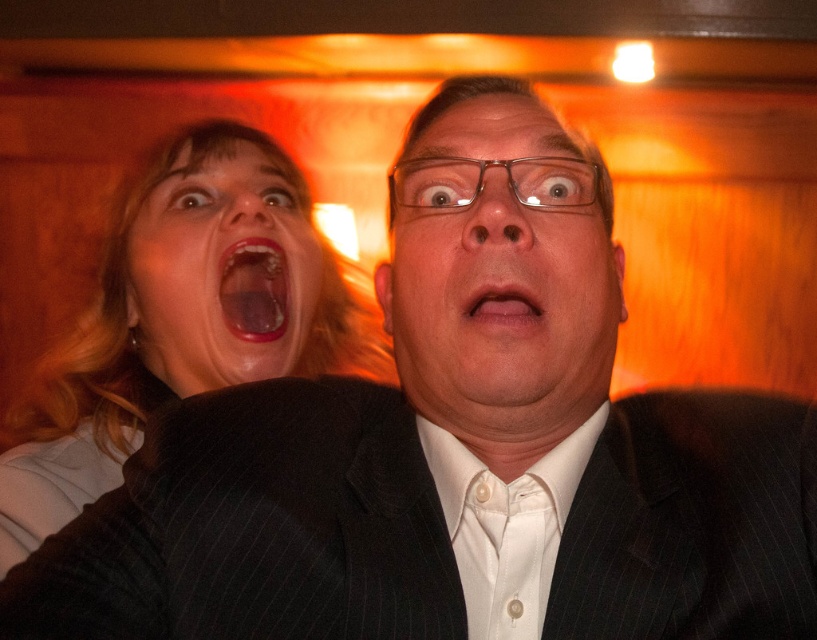
Question: Which point appears closest to the camera in this image?

Choices:
 (A) (528, 308)
 (B) (516, 609)

Answer: (A)

Question: Is matte black jacket at left wider than matte skin face at upper left?

Choices:
 (A) yes
 (B) no

Answer: (A)

Question: Is matte black jacket at left bigger than matte black suit at center?

Choices:
 (A) no
 (B) yes

Answer: (B)

Question: Is matte black jacket at left smaller than white satin tie at center?

Choices:
 (A) yes
 (B) no

Answer: (B)

Question: Among these points, which one is farthest from the camera?

Choices:
 (A) (246, 528)
 (B) (148, 385)
 (C) (277, 269)

Answer: (B)

Question: Which point is closer to the camera taking this photo?

Choices:
 (A) (61, 586)
 (B) (463, 481)

Answer: (A)